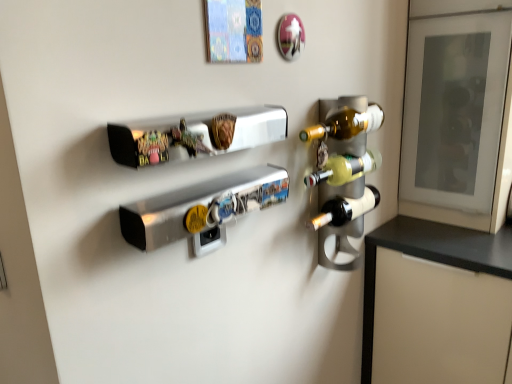
Question: Would you say translucent glass wine bottle at right, positioned as the 1th bottle in top-to-bottom order, is to the left or to the right of metallic silver shelf at upper center in the picture?

Choices:
 (A) left
 (B) right

Answer: (B)

Question: Considering the positions of translucent glass wine bottle at right, positioned as the 1th bottle in top-to-bottom order, and metallic silver shelf at upper center in the image, is translucent glass wine bottle at right, positioned as the 1th bottle in top-to-bottom order, taller or shorter than metallic silver shelf at upper center?

Choices:
 (A) tall
 (B) short

Answer: (A)

Question: Estimate the real-world distances between objects in this image. Which object is closer to the metallic silver shelf at upper center?

Choices:
 (A) translucent glass wine bottle at right, the second bottle ordered from the bottom
 (B) transparent glass door at upper right
 (C) brushed metal snowboard at center
 (D) matte black wine bottle at right, marked as the 2th bottle in a top-to-bottom arrangement

Answer: (C)

Question: Which object is the farthest from the matte black wine bottle at right, marked as the 2th bottle in a top-to-bottom arrangement?

Choices:
 (A) brushed metal snowboard at center
 (B) translucent glass wine bottle at right, positioned as the 1th bottle in top-to-bottom order
 (C) metallic silver shelf at upper center
 (D) transparent glass door at upper right

Answer: (D)